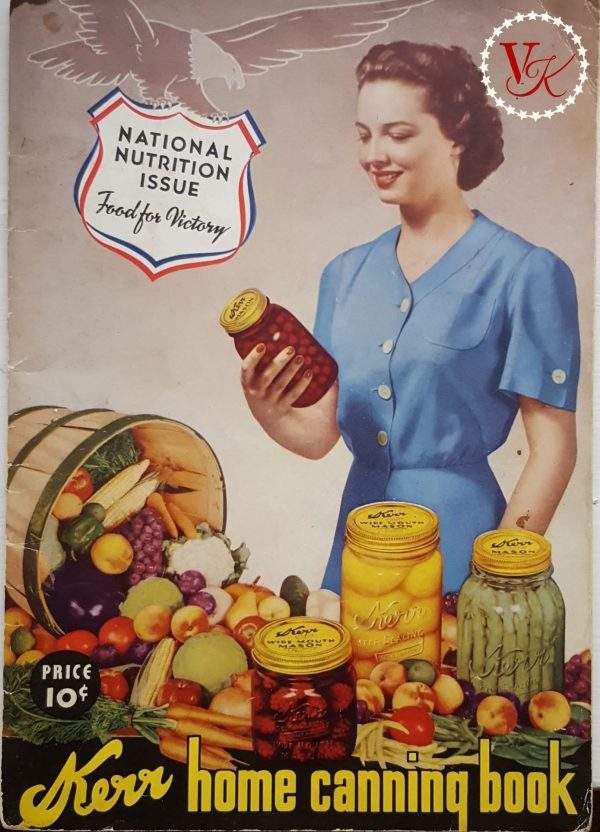
Image resolution: width=600 pixels, height=832 pixels. What are the coordinates of `basket` in the screenshot? It's located at (60, 444).